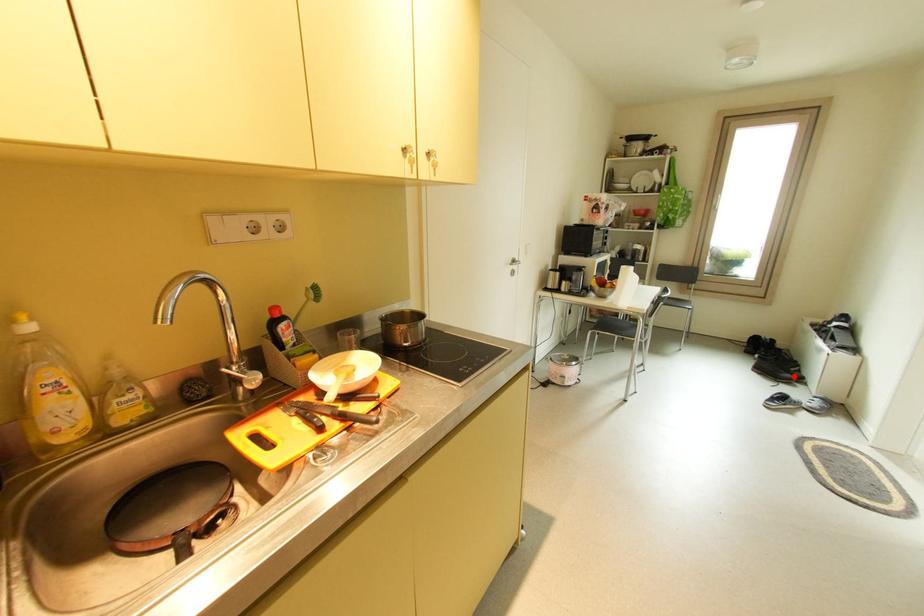
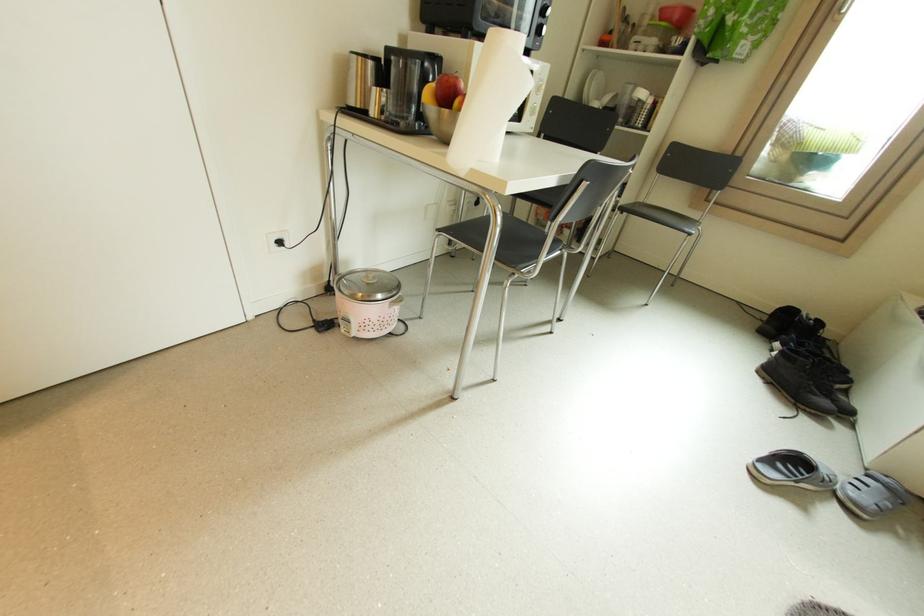
Question: I am providing you with two images of the same scene from different viewpoints. Image1 has a red point marked. In image2, the corresponding 3D location appears at what relative position? Reply with the corresponding letter.

Choices:
 (A) Closer
 (B) Farther

Answer: (B)